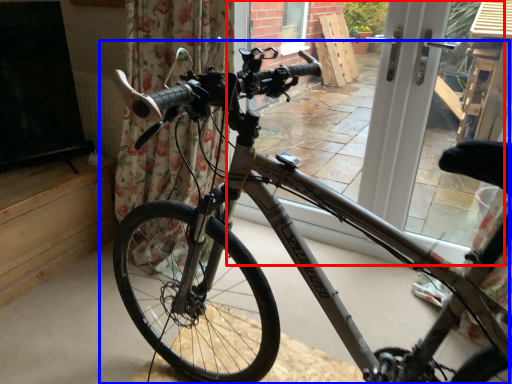
Question: Which object appears closest to the camera in this image, window frame (highlighted by a red box) or bicycle (highlighted by a blue box)?

Choices:
 (A) window frame
 (B) bicycle

Answer: (B)